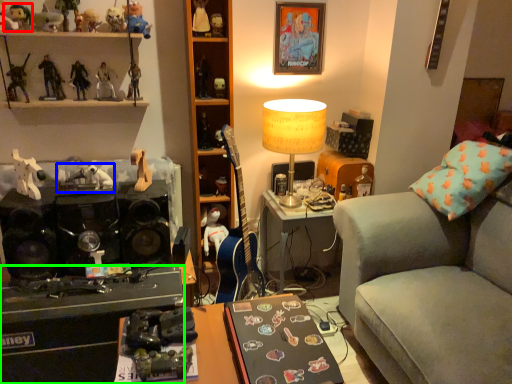
Question: Considering the real-world distances, which object is farthest from toy (highlighted by a red box)? toy (highlighted by a blue box) or desk (highlighted by a green box)?

Choices:
 (A) toy
 (B) desk

Answer: (B)